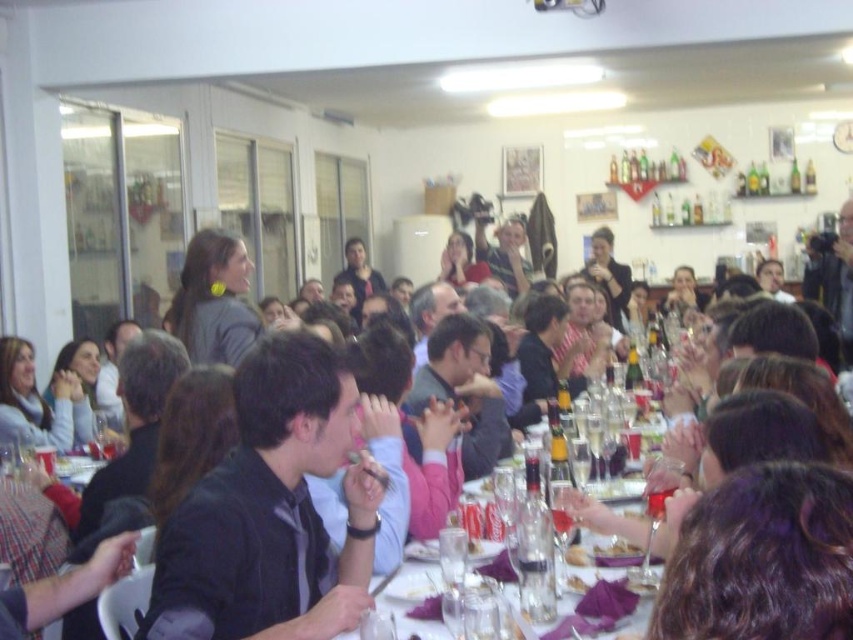
You are a photographer positioned at the end of the long table. You want to capture a photo that includes both the dark gray shirt at center and the smooth purple plate at center. Which object will appear larger in the photo?

The dark gray shirt at center will appear larger in the photo because it is closer to the viewer than the smooth purple plate at center.

You are a server at the event and need to place a new dessert plate on the table. Considering the clear glass table at center and the smooth purple plate at center, which object is wider?

The clear glass table at center is wider than the smooth purple plate at center.

What is the 2D coordinate of the clear glass table at center?

The clear glass table at center is located at the 2D coordinate point of (605, 518).